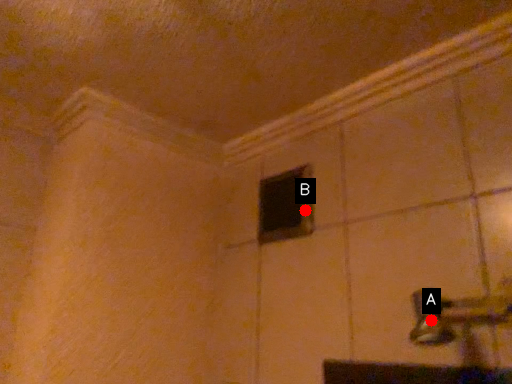
Question: Two points are circled on the image, labeled by A and B beside each circle. Which point is farther from the camera taking this photo?

Choices:
 (A) A is further
 (B) B is further

Answer: (B)